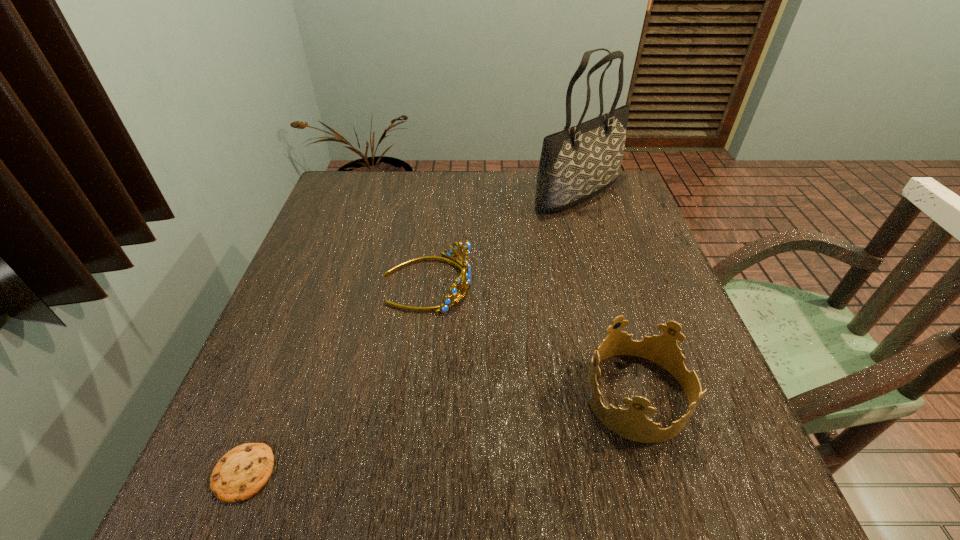
At what (x,y) coordinates should I click in order to perform the action: click on free spot that satisfies the following two spatial constraints: 1. on the front side of the farthest object; 2. on the front-facing side of the nearer tiara. Please return your answer as a coordinate pair (x, y). Looking at the image, I should click on (637, 395).

Find the location of a particular element. This screenshot has height=540, width=960. vacant region that satisfies the following two spatial constraints: 1. on the front-facing side of the farther tiara; 2. on the front side of the shortest object is located at coordinates (403, 473).